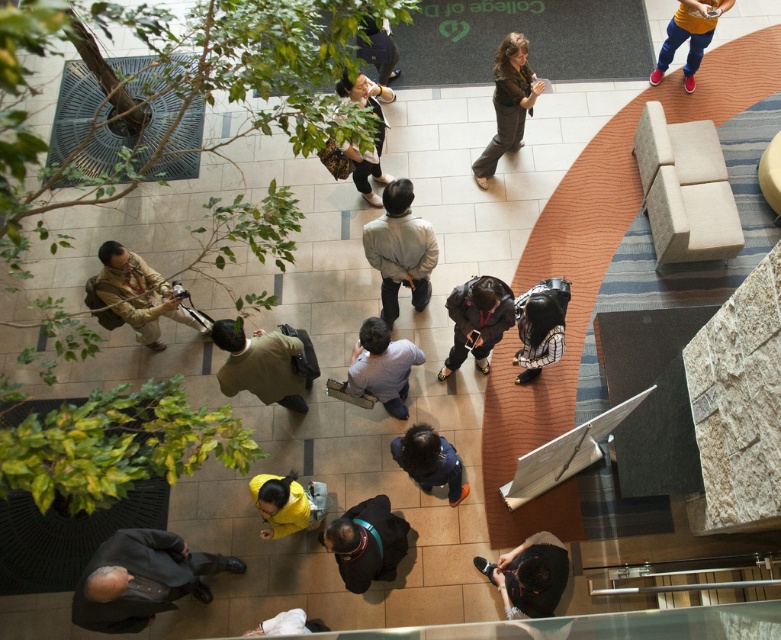
You are standing on the balcony looking down at the lobby. You see a dark gray hoodie at center and a yellow matte jacket at center. Which one is positioned to the right?

The dark gray hoodie at center is positioned to the right of the yellow matte jacket at center.

You are a store employee organizing jackets in the atrium. You need to place the light gray jacket at center and dark blue denim jacket at center on a shelf that can only hold items up to 1.2 meters in width. Given their widths, can both jackets fit side by side on the shelf?

The light gray jacket at center is narrower than the dark blue denim jacket at center. However, without knowing the exact widths of both jackets, it is impossible to determine if their combined width exceeds 1.2 meters. Additional information about each jacket is needed to make an accurate assessment.

You are standing at the point with coordinates (366, 541) in this indoor atrium scene. What object are you directly touching?

The point at coordinates (366, 541) is on the dark gray hoodie at center, so you are directly touching the dark gray hoodie at center.